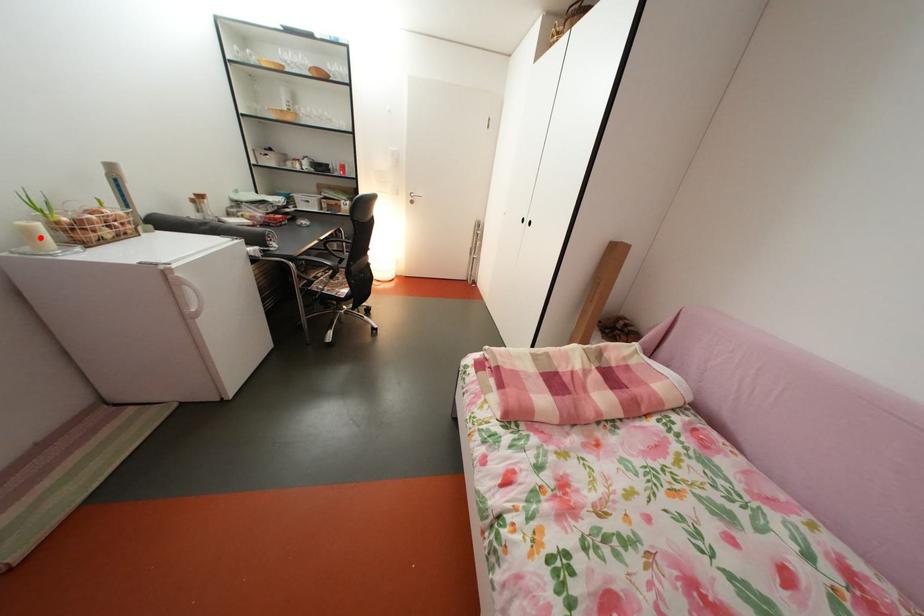
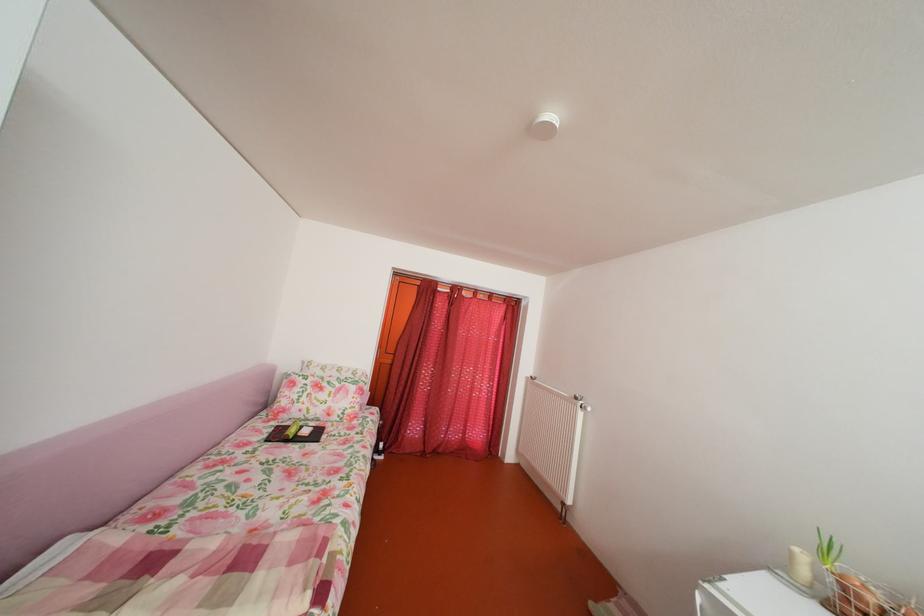
Find the pixel in the second image that matches the highlighted location in the first image.

(803, 561)